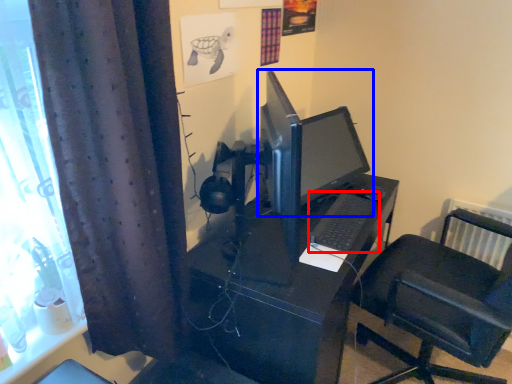
Question: Which object appears farthest to the camera in this image, computer keyboard (highlighted by a red box) or computer monitor (highlighted by a blue box)?

Choices:
 (A) computer keyboard
 (B) computer monitor

Answer: (A)